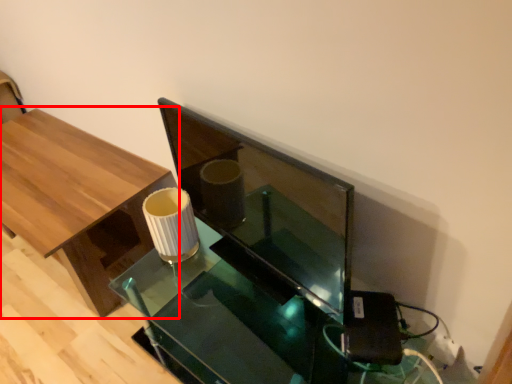
Question: Considering the relative positions of table (annotated by the red box) and round table in the image provided, where is table (annotated by the red box) located with respect to the staircase?

Choices:
 (A) right
 (B) left

Answer: (B)